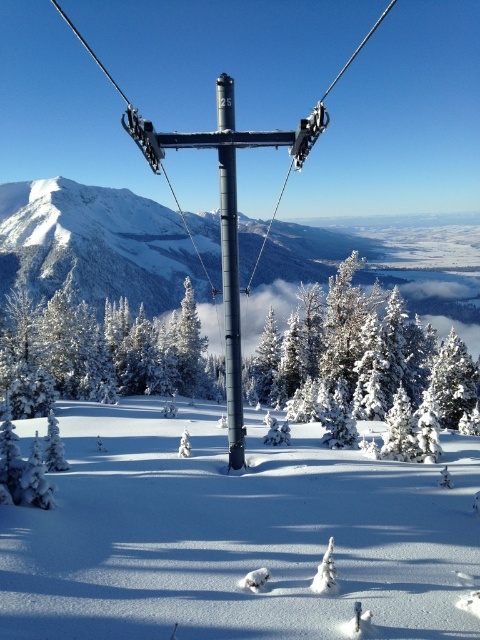
Question: Does white snow at center have a lesser width compared to metallic pole at center?

Choices:
 (A) yes
 (B) no

Answer: (B)

Question: Is white snow at center bigger than metallic pole at center?

Choices:
 (A) no
 (B) yes

Answer: (A)

Question: Which object appears closest to the camera in this image?

Choices:
 (A) white snow at center
 (B) metallic pole at center

Answer: (A)

Question: Which point is farther from the camera taking this photo?

Choices:
 (A) (218, 120)
 (B) (176, 598)

Answer: (A)

Question: Is white snow at center thinner than metallic pole at center?

Choices:
 (A) no
 (B) yes

Answer: (A)